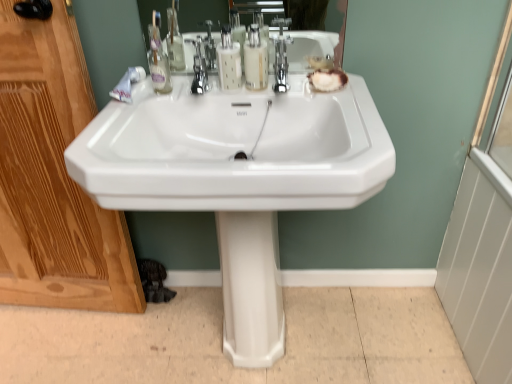
Question: Can you confirm if translucent plastic soap dispenser at center, acting as the first soap dispenser starting from the right, is positioned to the right of polished chrome faucet at center?

Choices:
 (A) no
 (B) yes

Answer: (A)

Question: Could polished chrome faucet at center be considered to be inside translucent plastic soap dispenser at center, the 2th soap dispenser positioned from the left?

Choices:
 (A) no
 (B) yes

Answer: (A)

Question: From the image's perspective, does translucent plastic soap dispenser at center, acting as the first soap dispenser starting from the right, appear lower than polished chrome faucet at center?

Choices:
 (A) yes
 (B) no

Answer: (B)

Question: Is translucent plastic soap dispenser at center, acting as the first soap dispenser starting from the right, thinner than polished chrome faucet at center?

Choices:
 (A) no
 (B) yes

Answer: (B)

Question: Considering the relative sizes of translucent plastic soap dispenser at center, the 2th soap dispenser positioned from the left, and polished chrome faucet at center in the image provided, is translucent plastic soap dispenser at center, the 2th soap dispenser positioned from the left, wider than polished chrome faucet at center?

Choices:
 (A) yes
 (B) no

Answer: (B)

Question: Choose the correct answer: Is white glossy pedestal at center inside translucent plastic soap dispenser at center, marked as the first soap dispenser in a left-to-right arrangement, or outside it?

Choices:
 (A) inside
 (B) outside

Answer: (B)

Question: Considering the positions of white glossy pedestal at center and translucent plastic soap dispenser at center, which is counted as the second soap dispenser, starting from the right, in the image, is white glossy pedestal at center wider or thinner than translucent plastic soap dispenser at center, which is counted as the second soap dispenser, starting from the right,?

Choices:
 (A) thin
 (B) wide

Answer: (B)

Question: In terms of size, does white glossy pedestal at center appear bigger or smaller than translucent plastic soap dispenser at center, marked as the first soap dispenser in a left-to-right arrangement?

Choices:
 (A) big
 (B) small

Answer: (A)

Question: Is white glossy pedestal at center taller or shorter than translucent plastic soap dispenser at center, marked as the first soap dispenser in a left-to-right arrangement?

Choices:
 (A) short
 (B) tall

Answer: (B)

Question: From a real-world perspective, is translucent plastic soap dispenser at center, acting as the first soap dispenser starting from the right, above or below white glossy pedestal at center?

Choices:
 (A) below
 (B) above

Answer: (B)

Question: From their relative heights in the image, would you say translucent plastic soap dispenser at center, the 2th soap dispenser positioned from the left, is taller or shorter than white glossy pedestal at center?

Choices:
 (A) tall
 (B) short

Answer: (B)

Question: Is translucent plastic soap dispenser at center, acting as the first soap dispenser starting from the right, wider or thinner than white glossy pedestal at center?

Choices:
 (A) thin
 (B) wide

Answer: (A)

Question: Is point (250, 69) closer or farther from the camera than point (245, 350)?

Choices:
 (A) closer
 (B) farther

Answer: (A)

Question: Considering the relative positions of translucent plastic soap dispenser at center, which is counted as the second soap dispenser, starting from the right, and white glossy sink at center in the image provided, is translucent plastic soap dispenser at center, which is counted as the second soap dispenser, starting from the right, to the left or to the right of white glossy sink at center?

Choices:
 (A) right
 (B) left

Answer: (B)

Question: Considering their positions, is translucent plastic soap dispenser at center, which is counted as the second soap dispenser, starting from the right, located in front of or behind white glossy sink at center?

Choices:
 (A) behind
 (B) front

Answer: (A)